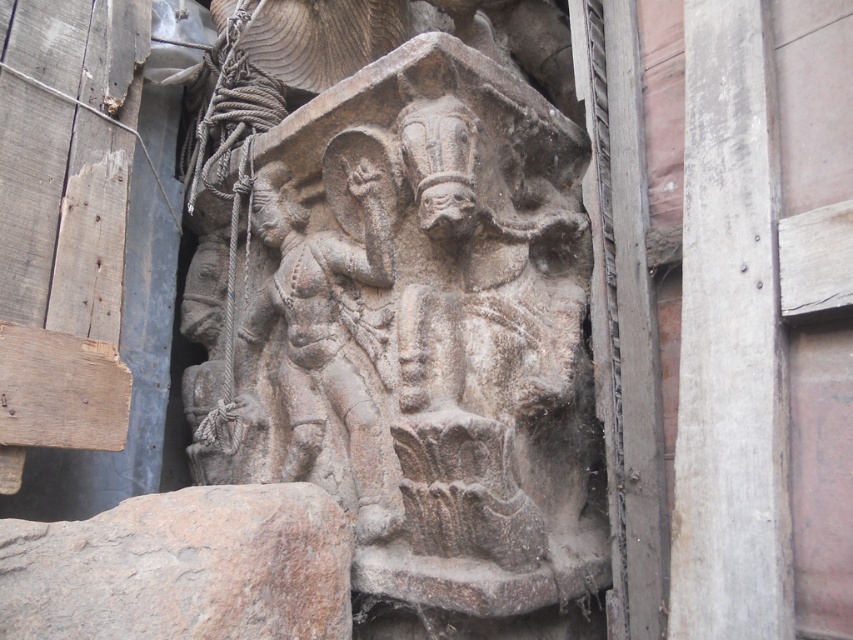
Which of these two, smooth concrete pillar at right or gray stone carving at center, stands shorter?

Standing shorter between the two is gray stone carving at center.

Which is in front, point (737, 118) or point (325, 632)?

Point (737, 118) is in front.

Identify the location of smooth concrete pillar at right. The image size is (853, 640). (729, 340).

Which is above, smooth concrete pillar at right or gray stone statue at center?

smooth concrete pillar at right

Is smooth concrete pillar at right below gray stone statue at center?

No.

You are a GUI agent. You are given a task and a screenshot of the screen. Output one action in this format:
    pyautogui.click(x=<x>, y=<y>)
    Task: Click on the smooth concrete pillar at right
    The height and width of the screenshot is (640, 853).
    Given the screenshot: What is the action you would take?
    pyautogui.click(x=729, y=340)

This screenshot has width=853, height=640. What are the coordinates of `smooth concrete pillar at right` in the screenshot? It's located at (729, 340).

Who is more forward, (480,609) or (399,515)?

Positioned in front is point (480,609).

Is gray stone sculpture at center to the right of gray stone statue at center from the viewer's perspective?

Yes, gray stone sculpture at center is to the right of gray stone statue at center.

Is point (479, 573) farther from viewer compared to point (323, 262)?

No, it is in front of (323, 262).

At what (x,y) coordinates should I click in order to perform the action: click on gray stone sculpture at center. Please return your answer as a coordinate pair (x, y). The width and height of the screenshot is (853, 640). Looking at the image, I should click on (410, 328).